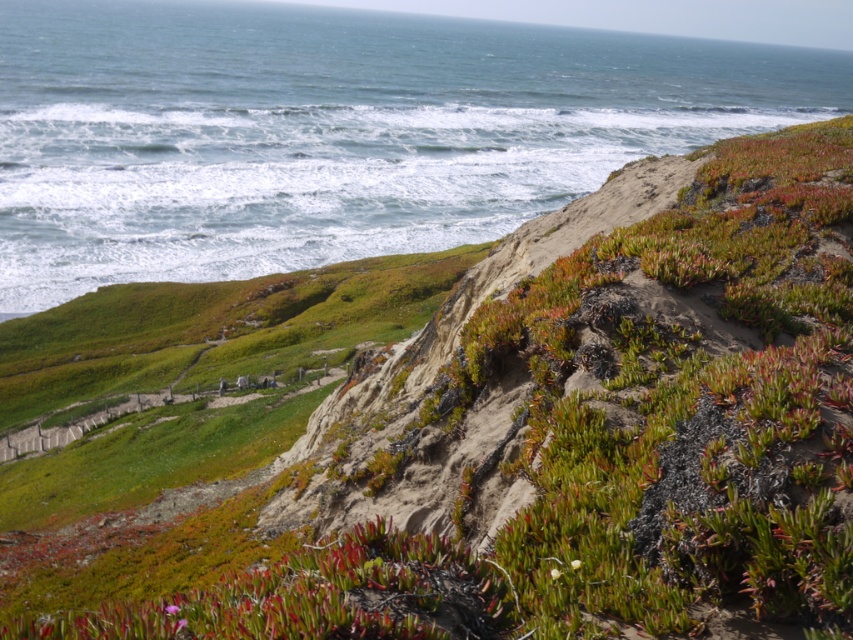
Does blue water at upper left lie in front of green succulent at lower left?

No, blue water at upper left is behind green succulent at lower left.

Identify the location of blue water at upper left. (334, 131).

This screenshot has width=853, height=640. In order to click on blue water at upper left in this screenshot , I will do `click(334, 131)`.

Between vivid pink petals at center and green succulent at center, which one has less height?

vivid pink petals at center is shorter.

Is vivid pink petals at center to the left of green succulent at center from the viewer's perspective?

Correct, you'll find vivid pink petals at center to the left of green succulent at center.

Between point (177, 605) and point (558, 570), which one is positioned behind?

The point (558, 570) is more distant.

You are a GUI agent. You are given a task and a screenshot of the screen. Output one action in this format:
    pyautogui.click(x=<x>, y=<y>)
    Task: Click on the vivid pink petals at center
    Image resolution: width=853 pixels, height=640 pixels.
    Given the screenshot: What is the action you would take?
    pyautogui.click(x=171, y=609)

Between vivid pink petals at center and green succulent at lower left, which one appears on the left side from the viewer's perspective?

Positioned to the left is vivid pink petals at center.

Who is taller, vivid pink petals at center or green succulent at lower left?

green succulent at lower left is taller.

Does point (177, 612) lie behind point (178, 628)?

That is True.

Where is `vivid pink petals at center`? This screenshot has height=640, width=853. vivid pink petals at center is located at coordinates point(171,609).